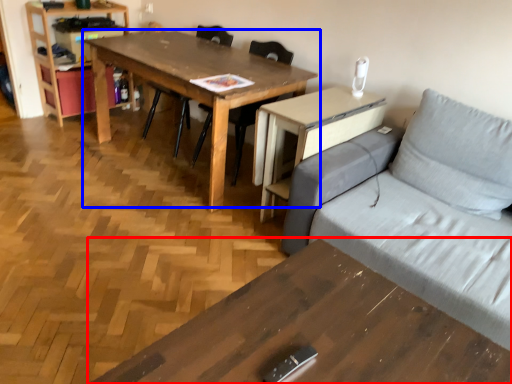
Question: Which object is closer to the camera taking this photo, table (highlighted by a red box) or table (highlighted by a blue box)?

Choices:
 (A) table
 (B) table

Answer: (A)